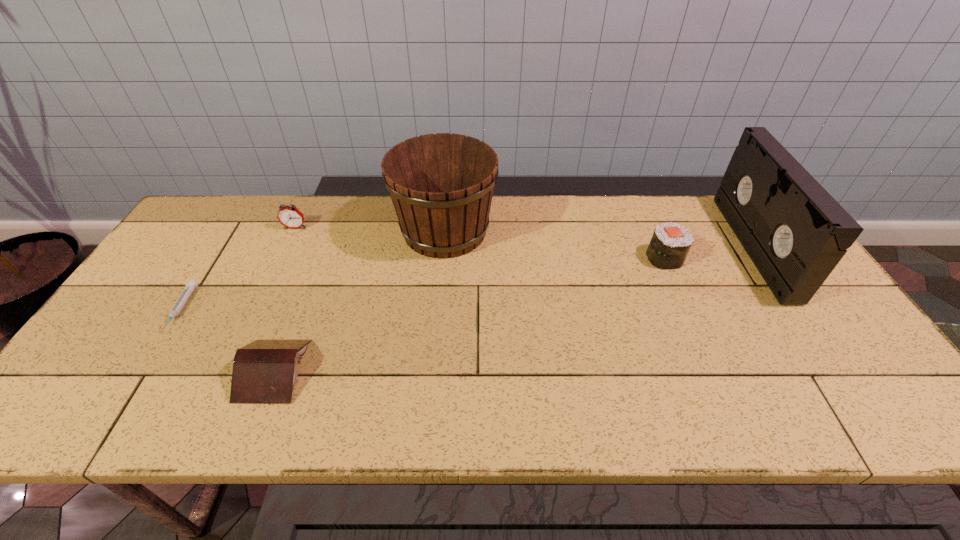
Identify the location of the rightmost object. (794, 231).

Locate an element on the screen. The height and width of the screenshot is (540, 960). the fourth object from left to right is located at coordinates (441, 185).

Locate an element on the screen. sushi is located at coordinates (670, 244).

Image resolution: width=960 pixels, height=540 pixels. I want to click on alarm clock, so click(x=289, y=216).

Locate an element on the screen. This screenshot has height=540, width=960. book is located at coordinates (264, 371).

Image resolution: width=960 pixels, height=540 pixels. I want to click on the nearest object, so click(x=264, y=371).

Identify the location of the shortest object. (191, 284).

This screenshot has height=540, width=960. What are the coordinates of `syringe` in the screenshot? It's located at (191, 284).

You are a GUI agent. You are given a task and a screenshot of the screen. Output one action in this format:
    pyautogui.click(x=<x>, y=<y>)
    Task: Click on the blank area located 0.130m on the side of the videotape with visible spindles
    Image resolution: width=960 pixels, height=540 pixels.
    Given the screenshot: What is the action you would take?
    pyautogui.click(x=699, y=247)

Where is `vacant space located 0.200m on the side of the videotape with visible spindles`? vacant space located 0.200m on the side of the videotape with visible spindles is located at coordinates (676, 247).